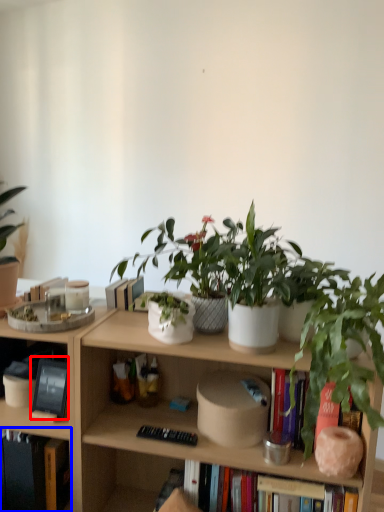
Question: Which object is further to the camera taking this photo, book (highlighted by a red box) or book (highlighted by a blue box)?

Choices:
 (A) book
 (B) book

Answer: (A)